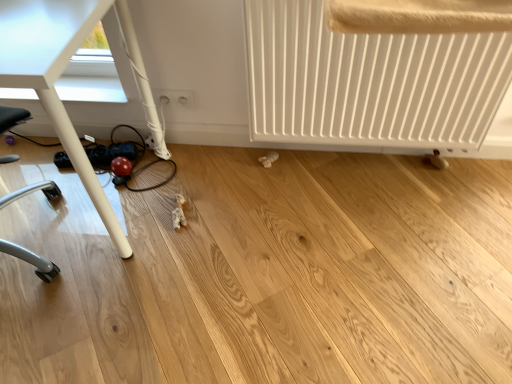
Question: From a real-world perspective, is white glossy table at lower left above or below white plastic outlets at lower center?

Choices:
 (A) above
 (B) below

Answer: (A)

Question: Visually, is white glossy table at lower left positioned to the left or to the right of white plastic outlets at lower center?

Choices:
 (A) right
 (B) left

Answer: (B)

Question: Which of these objects is positioned farthest from the white plastic outlets at lower center?

Choices:
 (A) white glossy table at lower left
 (B) white matte radiator at lower right

Answer: (B)

Question: Based on their relative distances, which object is farther from the white glossy table at lower left?

Choices:
 (A) white matte radiator at lower right
 (B) white plastic outlets at lower center

Answer: (A)